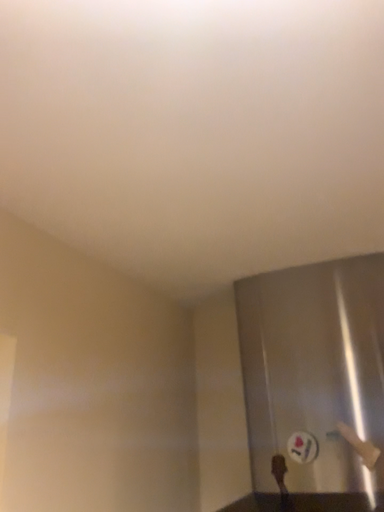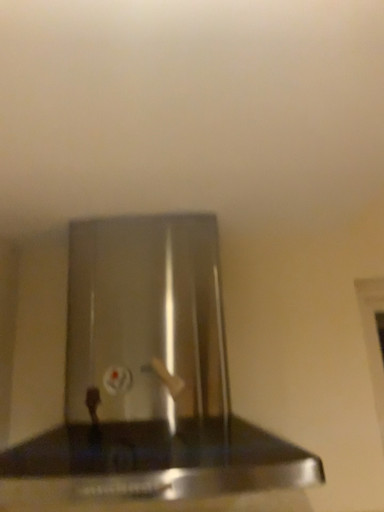
Question: How did the camera likely rotate when shooting the video?

Choices:
 (A) rotated right
 (B) rotated left

Answer: (A)